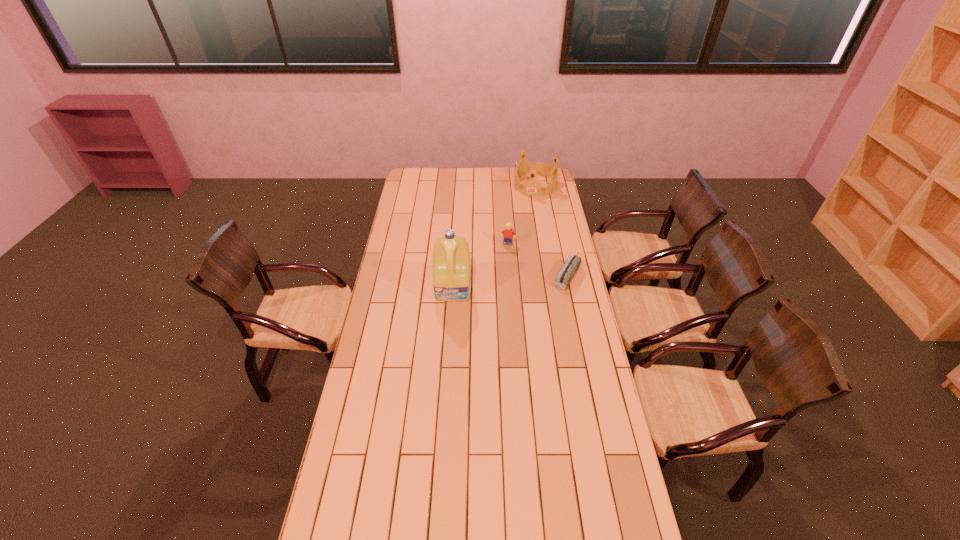
In order to click on free space on the desktop that is between the detergent and the shortest object and is positioned on the front-facing side of the tiara in this screenshot , I will do `click(503, 282)`.

Locate an element on the screen. free space on the desktop that is between the detergent and the pencil box and is positioned on the front-facing side of the third tallest object is located at coordinates (501, 283).